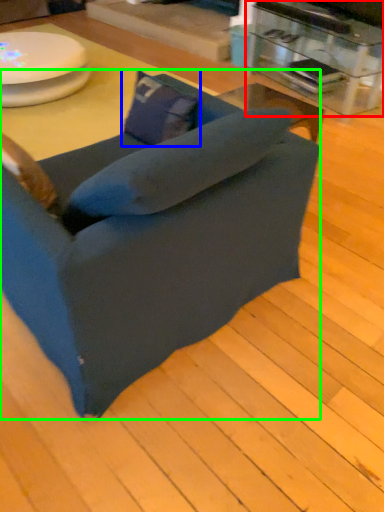
Question: Considering the real-world distances, which object is closest to table (highlighted by a red box)? pillow (highlighted by a blue box) or chair (highlighted by a green box).

Choices:
 (A) pillow
 (B) chair

Answer: (A)